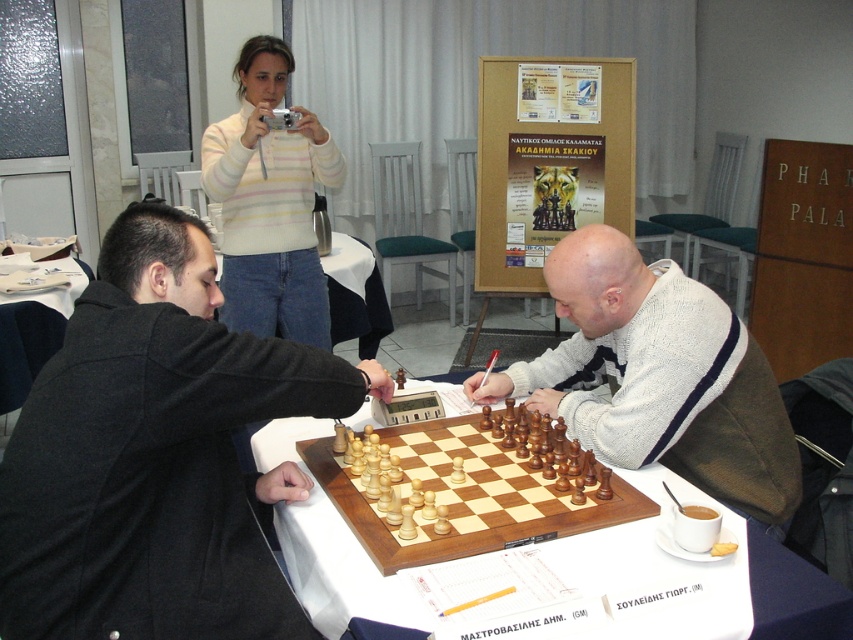
Question: Estimate the real-world distances between objects in this image. Which object is closer to the striped sweater at upper center?

Choices:
 (A) wooden chessboard at center
 (B) wooden chess set at center
 (C) dark gray wool coat at center
 (D) light brown wooden chessboard at center

Answer: (A)

Question: Is wooden chess set at center further to the viewer compared to light brown wooden chessboard at center?

Choices:
 (A) yes
 (B) no

Answer: (A)

Question: Can you confirm if wooden chess set at center is positioned above wooden chessboard at center?

Choices:
 (A) no
 (B) yes

Answer: (B)

Question: Among these points, which one is farthest from the camera?

Choices:
 (A) (296, 172)
 (B) (746, 403)

Answer: (A)

Question: Is light brown wooden chessboard at center wider than striped sweater at upper center?

Choices:
 (A) yes
 (B) no

Answer: (A)

Question: Which object appears closest to the camera in this image?

Choices:
 (A) striped sweater at upper center
 (B) light brown wooden chessboard at center
 (C) wooden chess set at center
 (D) dark gray wool coat at center

Answer: (D)